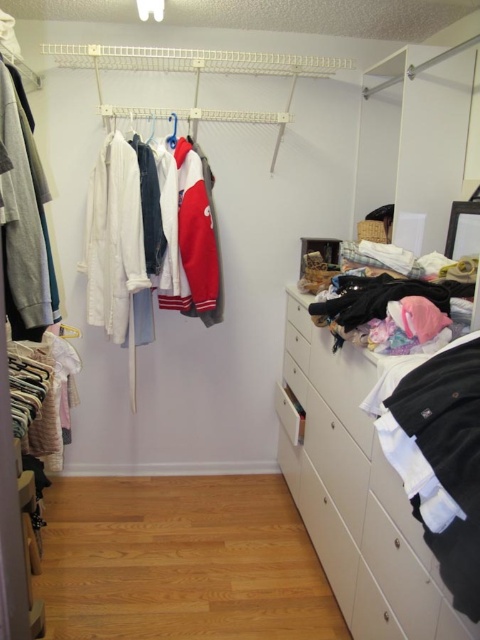
Between white glossy dresser at lower right and white fabric hanger at upper left, which one appears on the left side from the viewer's perspective?

Positioned to the left is white fabric hanger at upper left.

Is white glossy dresser at lower right taller than white fabric hanger at upper left?

Correct, white glossy dresser at lower right is much taller as white fabric hanger at upper left.

Is point (363, 529) behind point (170, 148)?

No, (363, 529) is in front of (170, 148).

At what (x,y) coordinates should I click in order to perform the action: click on white glossy dresser at lower right. Please return your answer as a coordinate pair (x, y). Looking at the image, I should click on (359, 499).

Measure the distance from matte gray sweater at left to white plastic drawer at center.

A distance of 3.79 feet exists between matte gray sweater at left and white plastic drawer at center.

Measure the distance from matte gray sweater at left to white plastic drawer at center.

matte gray sweater at left and white plastic drawer at center are 1.16 meters apart.

Who is more forward, (x=17, y=115) or (x=287, y=296)?

Positioned in front is point (x=17, y=115).

I want to click on matte gray sweater at left, so click(x=24, y=218).

Measure the distance between white matte drawer at center and white fabric hanger at upper left.

1.09 meters

Is point (308, 364) farther from viewer compared to point (173, 131)?

That is False.

Is point (291, 326) closer to viewer compared to point (177, 116)?

No, it is not.

You are a GUI agent. You are given a task and a screenshot of the screen. Output one action in this format:
    pyautogui.click(x=<x>, y=<y>)
    Task: Click on the white matte drawer at center
    This screenshot has height=640, width=480.
    Given the screenshot: What is the action you would take?
    pyautogui.click(x=297, y=346)